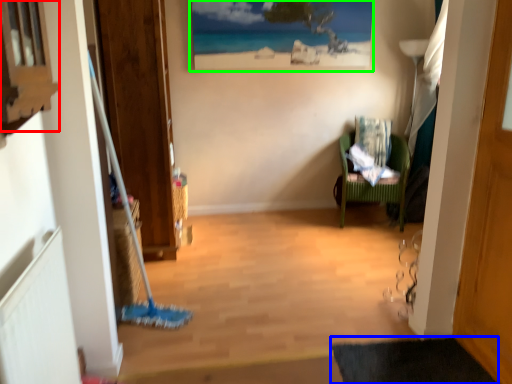
Question: Considering the real-world distances, which object is closest to window (highlighted by a red box)? bath mat (highlighted by a blue box) or picture frame (highlighted by a green box).

Choices:
 (A) bath mat
 (B) picture frame

Answer: (A)